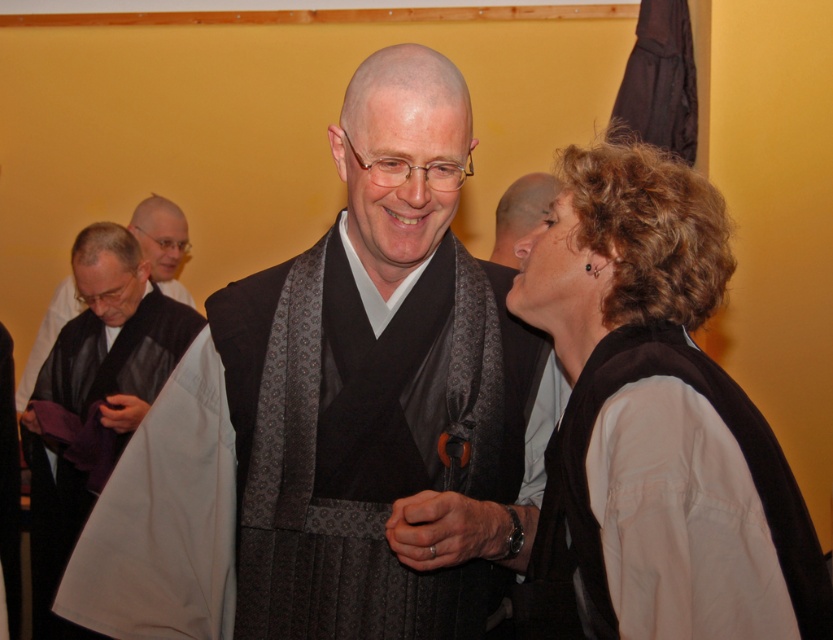
Between matte brown vest at right and black matte vest at left, which one appears on the right side from the viewer's perspective?

matte brown vest at right

Can you confirm if matte brown vest at right is positioned above black matte vest at left?

No, matte brown vest at right is not above black matte vest at left.

Describe the element at coordinates (656, 426) in the screenshot. I see `matte brown vest at right` at that location.

At what (x,y) coordinates should I click in order to perform the action: click on matte brown vest at right. Please return your answer as a coordinate pair (x, y). Image resolution: width=833 pixels, height=640 pixels. Looking at the image, I should click on (656, 426).

Does point (36, 339) come closer to viewer compared to point (509, 208)?

No, it is not.

Locate an element on the screen. black matte vest at left is located at coordinates (162, 243).

This screenshot has height=640, width=833. I want to click on black matte vest at left, so click(x=162, y=243).

Locate an element on the screen. This screenshot has height=640, width=833. black silk robe at lower left is located at coordinates (116, 355).

Does black silk robe at lower left appear over black matte vest at left?

No, black silk robe at lower left is not above black matte vest at left.

At what (x,y) coordinates should I click in order to perform the action: click on black silk robe at lower left. Please return your answer as a coordinate pair (x, y). Image resolution: width=833 pixels, height=640 pixels. Looking at the image, I should click on (116, 355).

Where is `black silk robe at lower left`? This screenshot has height=640, width=833. black silk robe at lower left is located at coordinates (116, 355).